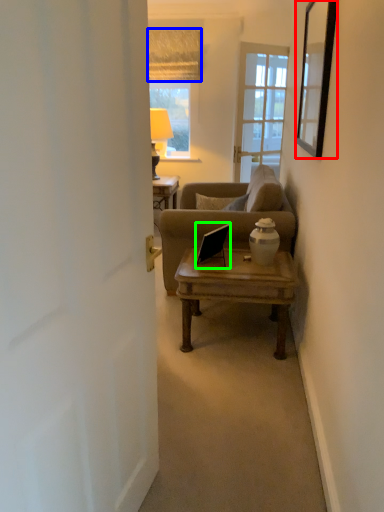
Question: Which object is the farthest from picture frame (highlighted by a red box)? Choose among these: curtain (highlighted by a blue box) or laptop (highlighted by a green box).

Choices:
 (A) curtain
 (B) laptop

Answer: (A)